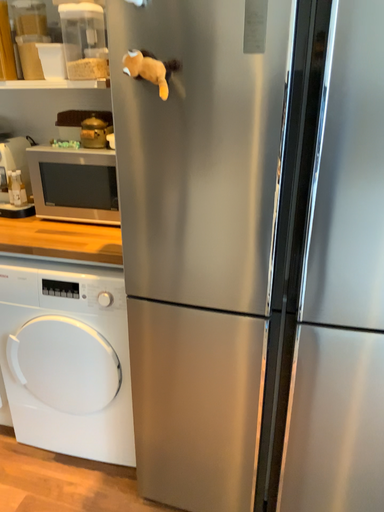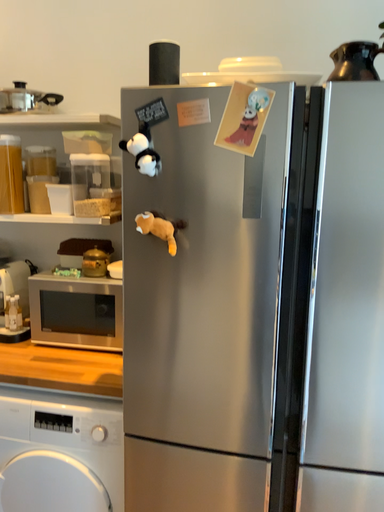
Question: Which way did the camera rotate in the video?

Choices:
 (A) rotated downward
 (B) rotated upward

Answer: (B)